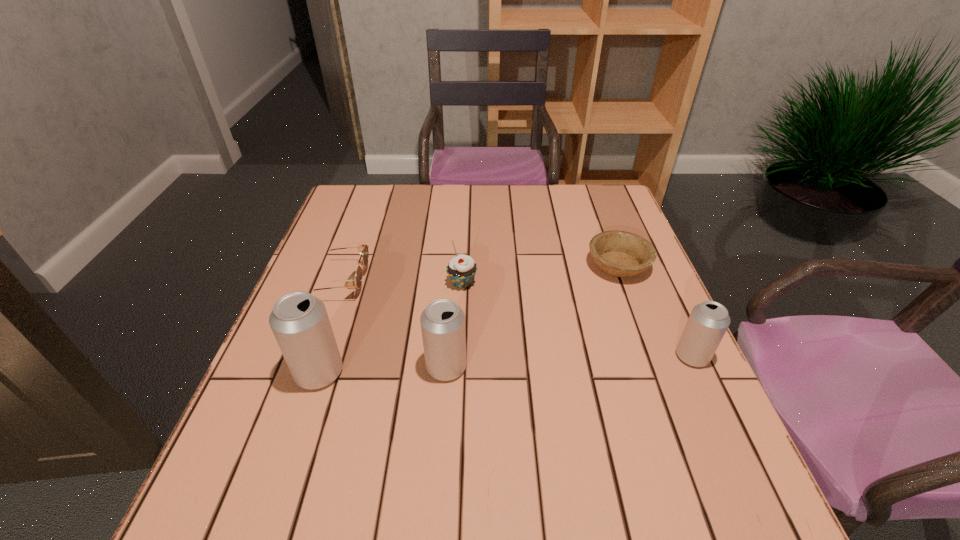
This screenshot has width=960, height=540. In order to click on the leftmost beer can in this screenshot , I will do `click(299, 321)`.

Where is `the fifth shortest object`? the fifth shortest object is located at coordinates (442, 322).

The height and width of the screenshot is (540, 960). I want to click on the second shortest beer can, so click(442, 322).

Where is `the rightmost beer can`? The height and width of the screenshot is (540, 960). the rightmost beer can is located at coordinates (708, 322).

You are a GUI agent. You are given a task and a screenshot of the screen. Output one action in this format:
    pyautogui.click(x=<x>, y=<y>)
    Task: Click on the fourth shortest object
    
    Given the screenshot: What is the action you would take?
    pyautogui.click(x=708, y=322)

What are the coordinates of `the shortest object` in the screenshot? It's located at (619, 253).

The height and width of the screenshot is (540, 960). Identify the location of sunglasses. (362, 248).

Where is `the third shortest object`? Image resolution: width=960 pixels, height=540 pixels. the third shortest object is located at coordinates (461, 269).

Image resolution: width=960 pixels, height=540 pixels. I want to click on free region located on the back of the leftmost beer can, so click(x=337, y=319).

I want to click on vacant space located on the back of the second tallest beer can, so click(x=452, y=285).